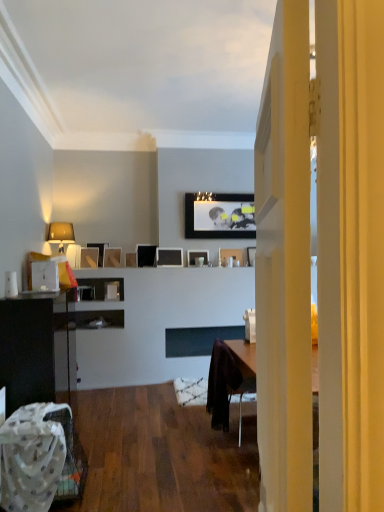
Question: Looking at the image, does matte black picture frame at center, arranged as the 9th picture frame when viewed from the right, seem bigger or smaller compared to matte black cabinet at left?

Choices:
 (A) small
 (B) big

Answer: (A)

Question: From a real-world perspective, is matte black picture frame at center, arranged as the 9th picture frame when viewed from the right, positioned above or below matte black cabinet at left?

Choices:
 (A) above
 (B) below

Answer: (A)

Question: Which object is positioned farthest from the matte black picture frame at upper center, the first picture frame from the right?

Choices:
 (A) matte wooden picture frame at upper center, which ranks as the 10th picture frame in right-to-left order
 (B) white fabric chair at lower left
 (C) velvet dark brown swivel chair at center
 (D) wooden picture frame at center, acting as the seventh picture frame starting from the right
 (E) matte white picture frame at center, which ranks as the 2th picture frame in right-to-left order

Answer: (B)

Question: Estimate the real-world distances between objects in this image. Which object is farther from the matte white picture frame at center, which is the 9th picture frame in left-to-right order?

Choices:
 (A) matte black picture frame at upper center, which is the 7th picture frame in left-to-right order
 (B) matte black picture frame at upper center, the fifth picture frame viewed from the left
 (C) wooden picture frame at center, positioned as the fourth picture frame in left-to-right order
 (D) matte black picture frame at center, arranged as the 9th picture frame when viewed from the right
 (E) matte black picture frame at upper center, the eighth picture frame from the left

Answer: (D)